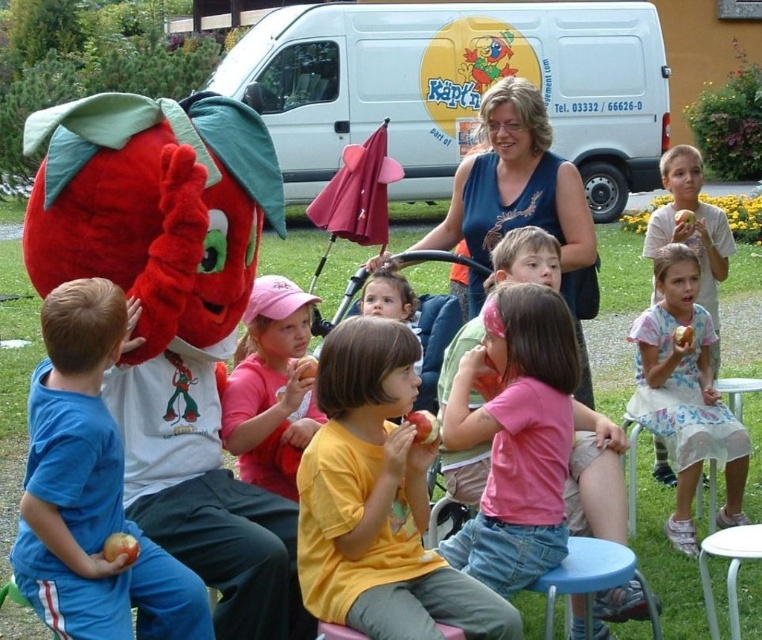
Question: Based on their relative distances, which object is farther from the smooth apple at lower right?

Choices:
 (A) red matte apple at center
 (B) smooth plastic apple at lower right

Answer: (A)

Question: From the image, what is the correct spatial relationship of floral cotton dress at lower right in relation to red matte apple at center?

Choices:
 (A) left
 (B) right

Answer: (B)

Question: Where is pink fabric cap at center located in relation to smooth golden apple at lower left in the image?

Choices:
 (A) below
 (B) above

Answer: (B)

Question: Which point is closer to the camera?

Choices:
 (A) (312, 568)
 (B) (679, 340)

Answer: (A)

Question: Where is floral cotton dress at lower right located in relation to smooth plastic apple at lower right in the image?

Choices:
 (A) below
 (B) above

Answer: (A)

Question: Which of the following is the farthest from the observer?

Choices:
 (A) (130, 561)
 (B) (674, 406)
 (C) (207, 611)

Answer: (B)